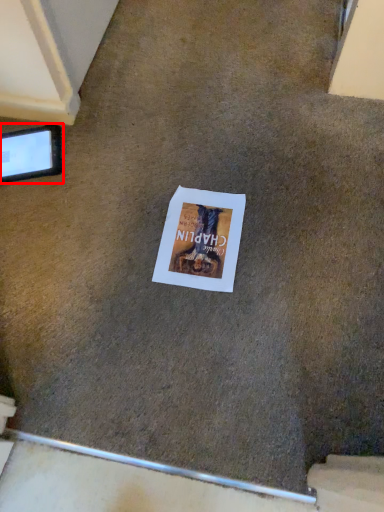
Question: Observing the image, what is the correct spatial positioning of tablet computer (annotated by the red box) in reference to flyer?

Choices:
 (A) right
 (B) left

Answer: (B)